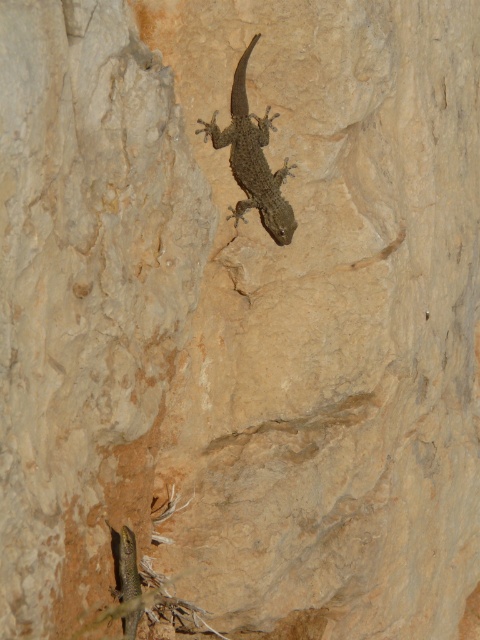
Question: Which point is closer to the camera?

Choices:
 (A) green scaly lizard at lower left
 (B) smooth brown lizard at center

Answer: (A)

Question: Does smooth brown lizard at center appear over green scaly lizard at lower left?

Choices:
 (A) no
 (B) yes

Answer: (B)

Question: Can you confirm if smooth brown lizard at center is wider than green scaly lizard at lower left?

Choices:
 (A) no
 (B) yes

Answer: (B)

Question: Which of the following is the closest to the observer?

Choices:
 (A) (277, 115)
 (B) (128, 612)

Answer: (B)

Question: Which point is farther to the camera?

Choices:
 (A) (113, 588)
 (B) (275, 177)

Answer: (B)

Question: Does smooth brown lizard at center appear on the right side of green scaly lizard at lower left?

Choices:
 (A) yes
 (B) no

Answer: (A)